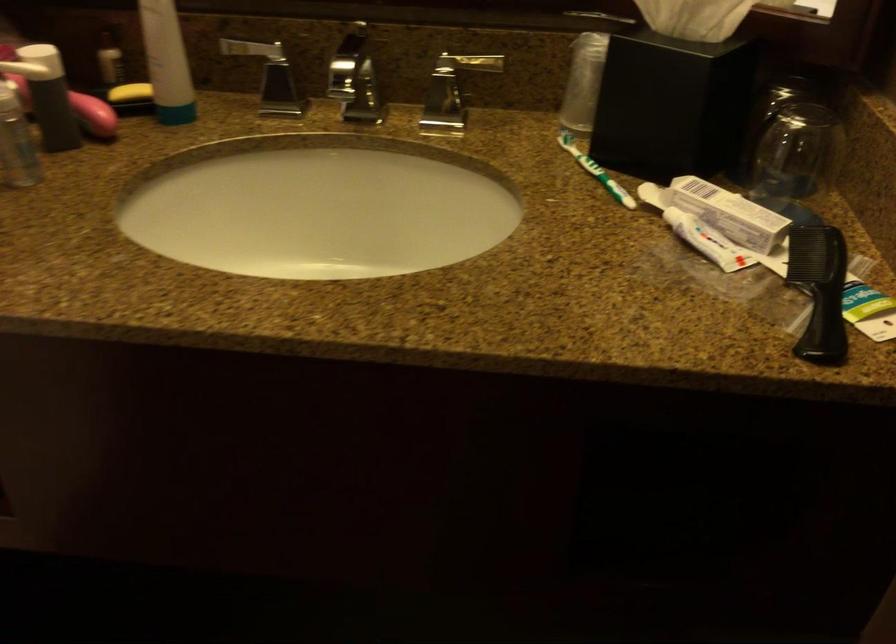
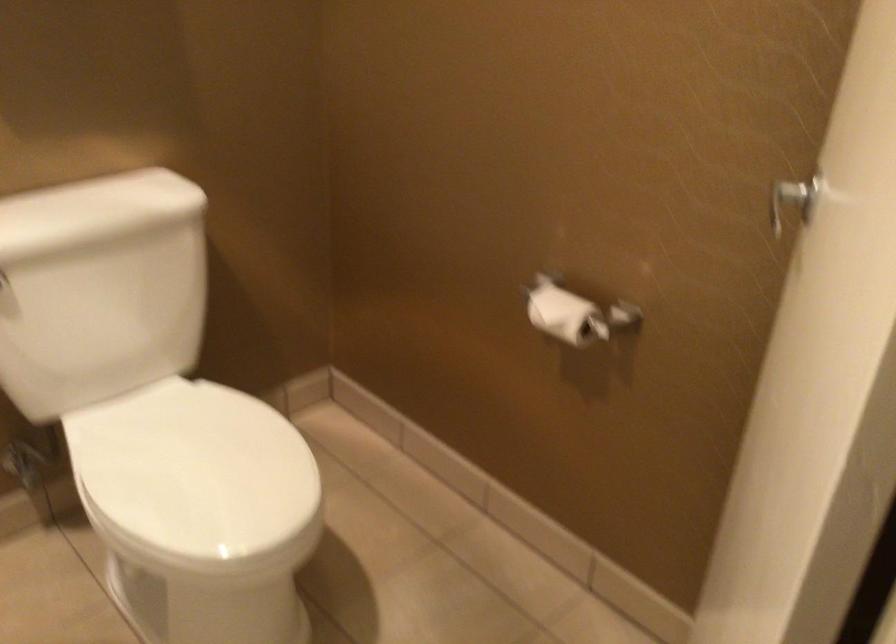
Question: The images are taken continuously from a first-person perspective. In which direction is your viewpoint rotating?

Choices:
 (A) Left
 (B) Right
 (C) Up
 (D) Down

Answer: (A)